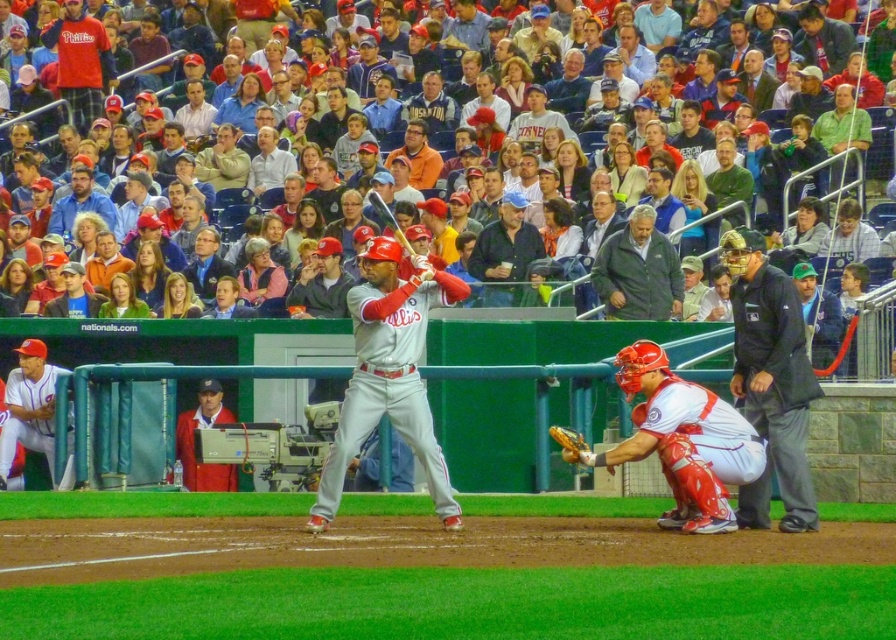
In the scene shown: Between white matte uniform at lower right and red jacket at lower left, which one has less height?

With less height is red jacket at lower left.

Which is behind, point (636, 435) or point (183, 444)?

Point (183, 444)

You are a GUI agent. You are given a task and a screenshot of the screen. Output one action in this format:
    pyautogui.click(x=<x>, y=<y>)
    Task: Click on the white matte uniform at lower right
    This screenshot has height=640, width=896.
    Given the screenshot: What is the action you would take?
    pyautogui.click(x=683, y=440)

Where is `white matte uniform at lower right`? The image size is (896, 640). white matte uniform at lower right is located at coordinates (683, 440).

Does matte gray jacket at upper center have a greater height compared to orange cotton shirt at upper center?

Incorrect, matte gray jacket at upper center's height is not larger of orange cotton shirt at upper center's.

Does matte gray jacket at upper center appear on the left side of orange cotton shirt at upper center?

Yes, matte gray jacket at upper center is to the left of orange cotton shirt at upper center.

This screenshot has height=640, width=896. Identify the location of matte gray jacket at upper center. (141, 340).

This screenshot has height=640, width=896. In order to click on matte gray jacket at upper center in this screenshot , I will do `click(141, 340)`.

Does point (800, 417) come closer to viewer compared to point (806, 332)?

No, (800, 417) is further to viewer.

Between point (734, 320) and point (830, 362), which one is positioned in front?

Point (734, 320) is more forward.

Where is `black fabric umpire at right`? This screenshot has width=896, height=640. black fabric umpire at right is located at coordinates (770, 380).